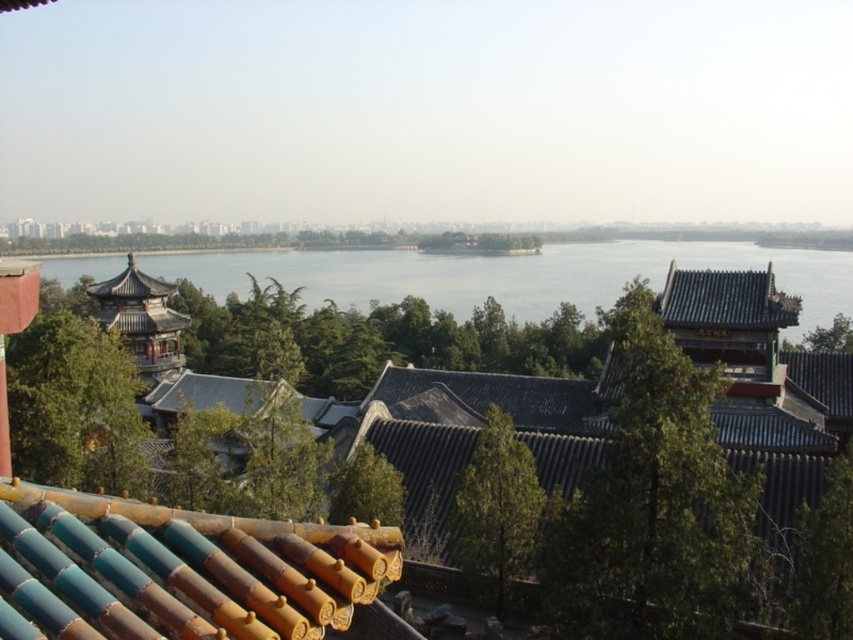
You are an architect analyzing the layout of this historical site. Based on the scene, which object is positioned higher in the visual hierarchy, the blue water at center or the shiny dark blue tiled roof at upper right?

The blue water at center is positioned above the shiny dark blue tiled roof at upper right, making it higher in the visual hierarchy.

You are an architect visiting this historical site and want to take a photo that includes both the teal glazed tiles at center and the shiny dark blue tiled roof at upper right. Based on their positions, which object should you place on the left side of your camera frame to ensure both are visible?

The teal glazed tiles at center should be placed on the left side of your camera frame because it is already positioned on the left side of the shiny dark blue tiled roof at upper right, ensuring both objects are visible in the frame.

You are standing in the serene landscape and want to take a photo of the teal glazed tiles at center and the blue water at center. Which object should you focus on first to ensure both are in the frame?

You should focus on the teal glazed tiles at center first because it is closer to the viewer than the blue water at center, ensuring both are in the frame by starting with the closer object.